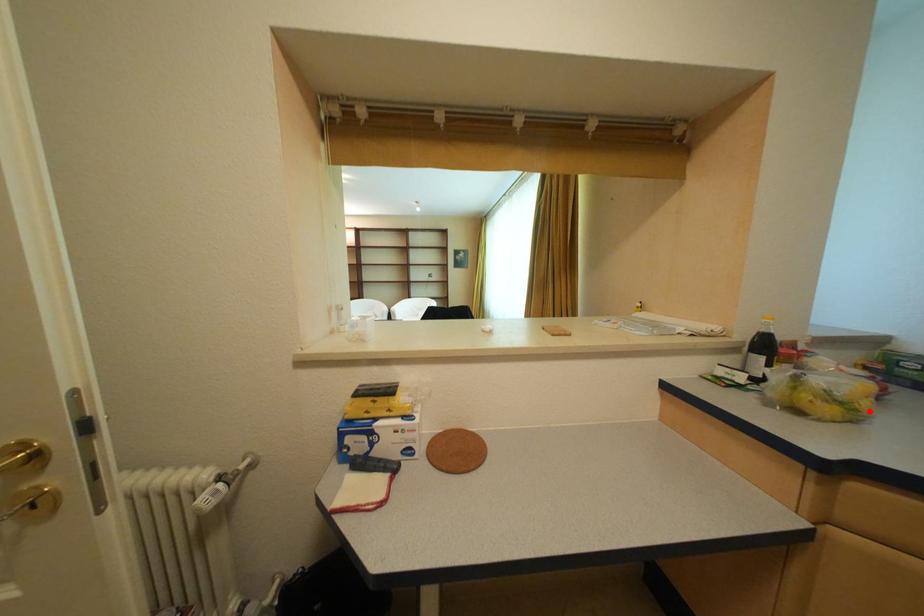
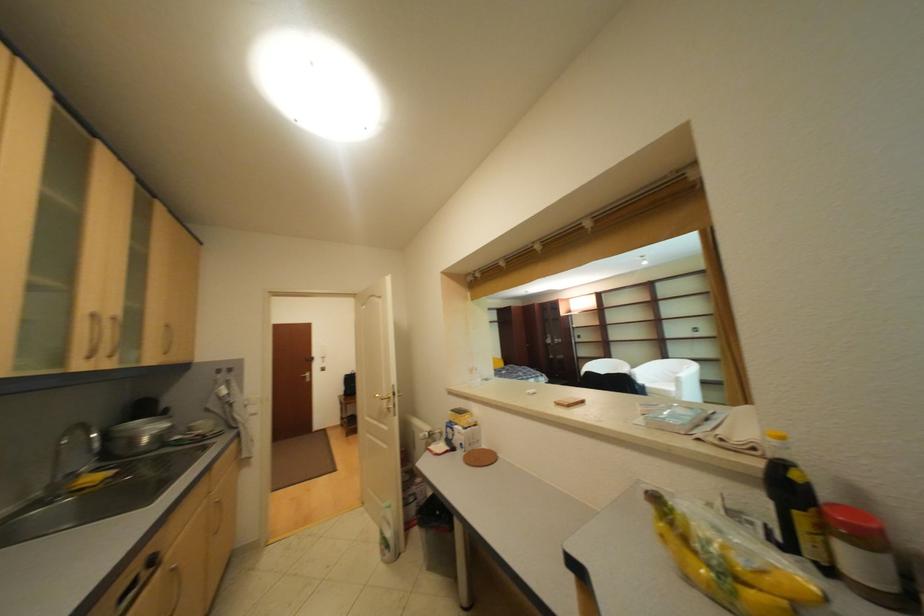
In the second image, find the point that corresponds to the highlighted location in the first image.

(747, 596)